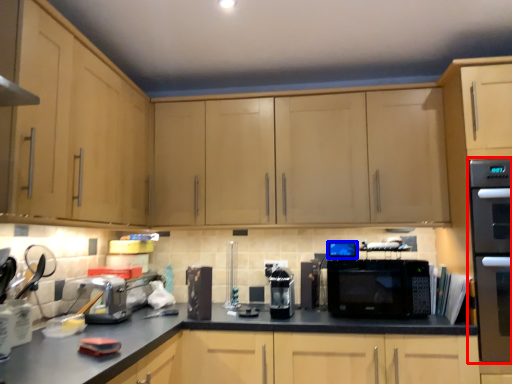
Question: Which object is closer to the camera taking this photo, home appliance (highlighted by a red box) or appliance (highlighted by a blue box)?

Choices:
 (A) home appliance
 (B) appliance

Answer: (A)